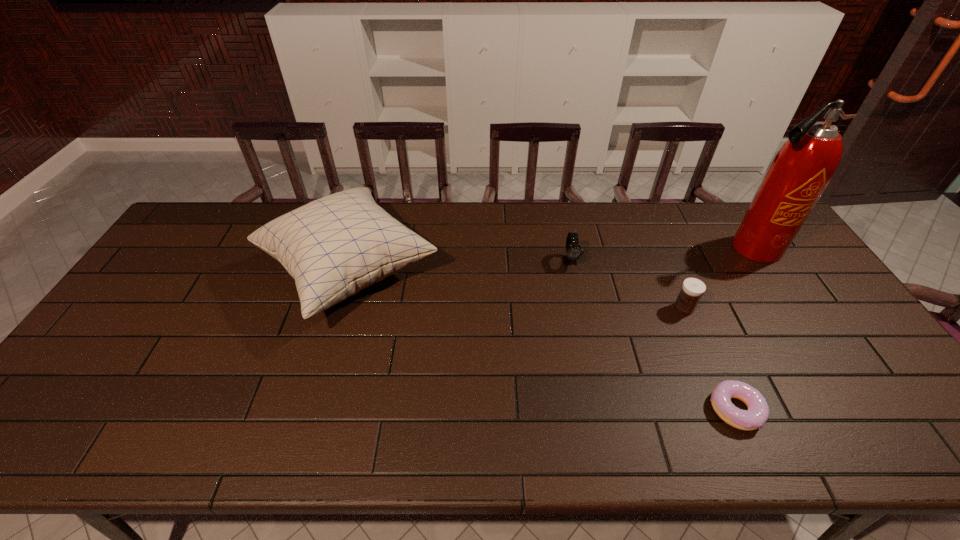
Where is `vacant space situated on the face of the fourth object from right to left`? The width and height of the screenshot is (960, 540). vacant space situated on the face of the fourth object from right to left is located at coordinates (581, 309).

Where is `vacant space positioned 0.270m on the front of the medicine`? The width and height of the screenshot is (960, 540). vacant space positioned 0.270m on the front of the medicine is located at coordinates (725, 404).

Image resolution: width=960 pixels, height=540 pixels. I want to click on vacant region located 0.100m on the back of the nearest object, so pyautogui.click(x=710, y=352).

Locate an element on the screen. The width and height of the screenshot is (960, 540). fire extinguisher at the far edge is located at coordinates (800, 172).

This screenshot has height=540, width=960. In order to click on cushion at the far edge in this screenshot , I will do `click(335, 246)`.

I want to click on object that is positioned at the near edge, so click(757, 414).

Find the location of `object present at the right edge`. object present at the right edge is located at coordinates 800,172.

Locate an element on the screen. The width and height of the screenshot is (960, 540). object at the far right corner is located at coordinates (800, 172).

Find the location of `vacant space at the far edge of the desktop`. vacant space at the far edge of the desktop is located at coordinates (581, 225).

Where is `blank space at the near edge of the desktop`? This screenshot has height=540, width=960. blank space at the near edge of the desktop is located at coordinates (857, 435).